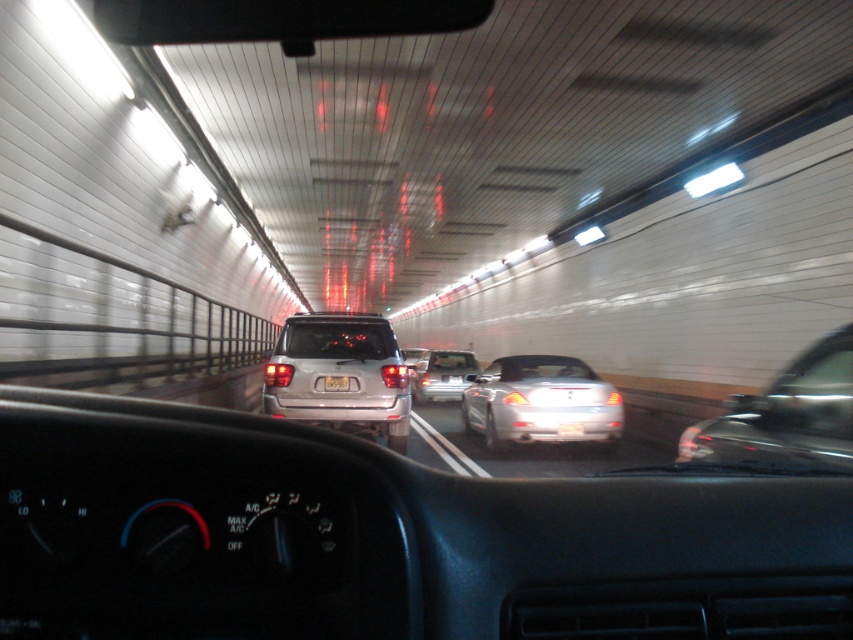
Does metallic silver sedan at right appear on the left side of white plastic license plate at center?

No, metallic silver sedan at right is not to the left of white plastic license plate at center.

Between point (767, 417) and point (346, 385), which one is positioned behind?

Point (346, 385)

Where is `metallic silver sedan at right`? metallic silver sedan at right is located at coordinates (786, 417).

From the picture: Can you confirm if metallic silver sedan at right is smaller than silver metallic sedan at center?

Correct, metallic silver sedan at right occupies less space than silver metallic sedan at center.

Who is positioned more to the right, metallic silver sedan at right or silver metallic sedan at center?

metallic silver sedan at right is more to the right.

Is point (683, 440) farther from camera compared to point (581, 365)?

That is False.

You are a GUI agent. You are given a task and a screenshot of the screen. Output one action in this format:
    pyautogui.click(x=<x>, y=<y>)
    Task: Click on the metallic silver sedan at right
    The image size is (853, 640).
    Given the screenshot: What is the action you would take?
    pyautogui.click(x=786, y=417)

Does satin silver sedan at center have a greater width compared to white plastic license plate at center?

Correct, the width of satin silver sedan at center exceeds that of white plastic license plate at center.

Between satin silver sedan at center and white plastic license plate at center, which one has less height?

Standing shorter between the two is white plastic license plate at center.

Is point (454, 397) positioned after point (334, 388)?

That is True.

Find the location of a particular element. satin silver sedan at center is located at coordinates (440, 374).